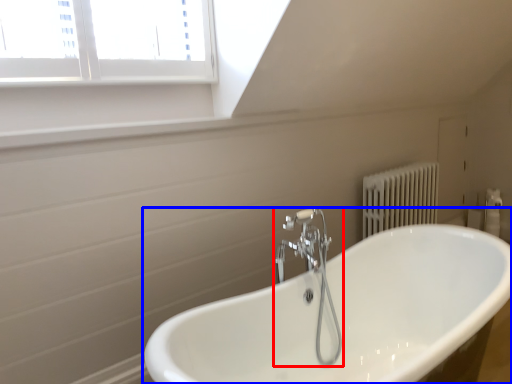
Question: Which object is closer to the camera taking this photo, tap (highlighted by a red box) or bathtub (highlighted by a blue box)?

Choices:
 (A) tap
 (B) bathtub

Answer: (B)